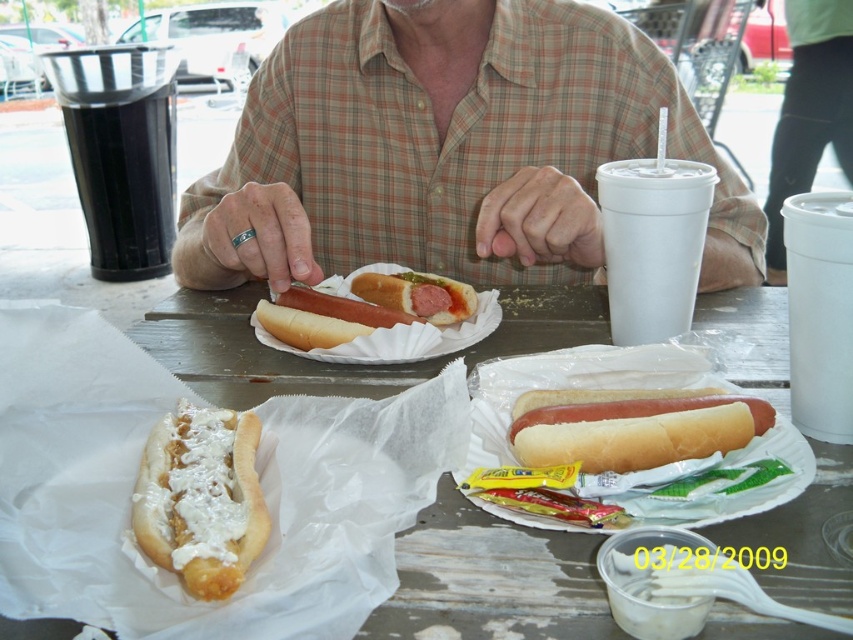
Is white paper hot dog at center behind matte white bun at center?

No, it is in front of matte white bun at center.

Is white paper hot dog at center to the right of matte white bun at center from the viewer's perspective?

Indeed, white paper hot dog at center is positioned on the right side of matte white bun at center.

Between point (741, 301) and point (292, 328), which one is positioned in front?

Point (292, 328)

Where is `white paper hot dog at center`? This screenshot has height=640, width=853. white paper hot dog at center is located at coordinates (x=491, y=579).

Who is taller, plaid shirt at center or white bread hot dog at center?

plaid shirt at center is taller.

Is plaid shirt at center to the right of white bread hot dog at center from the viewer's perspective?

Answer: No, plaid shirt at center is not to the right of white bread hot dog at center.

Find the location of `plaid shirt at center`. plaid shirt at center is located at coordinates (447, 148).

Can you confirm if plaid shirt at center is smaller than smooth red hot dog at center?

Incorrect, plaid shirt at center is not smaller in size than smooth red hot dog at center.

Does plaid shirt at center appear on the left side of smooth red hot dog at center?

Incorrect, plaid shirt at center is not on the left side of smooth red hot dog at center.

Does point (321, 49) come in front of point (373, 276)?

No, it is not.

Where is `plaid shirt at center`? Image resolution: width=853 pixels, height=640 pixels. plaid shirt at center is located at coordinates (447, 148).